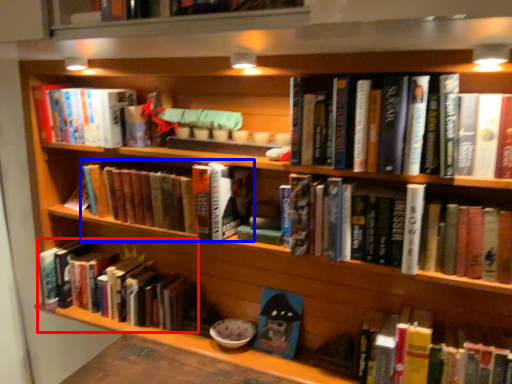
Question: Which of the following is the farthest to the observer, book (highlighted by a red box) or book (highlighted by a blue box)?

Choices:
 (A) book
 (B) book

Answer: (A)